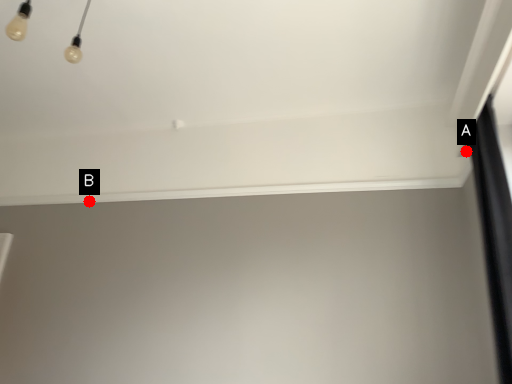
Question: Two points are circled on the image, labeled by A and B beside each circle. Which point appears closest to the camera in this image?

Choices:
 (A) A is closer
 (B) B is closer

Answer: (A)